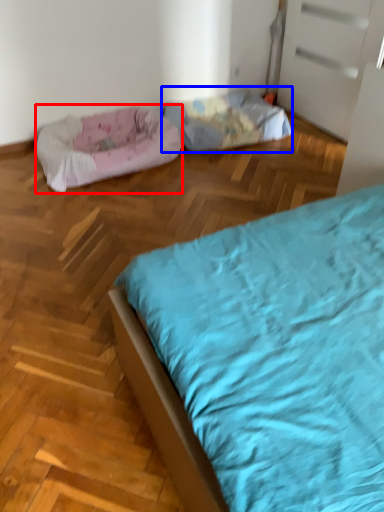
Question: Which object is further to the camera taking this photo, dog bed (highlighted by a red box) or dog bed (highlighted by a blue box)?

Choices:
 (A) dog bed
 (B) dog bed

Answer: (B)